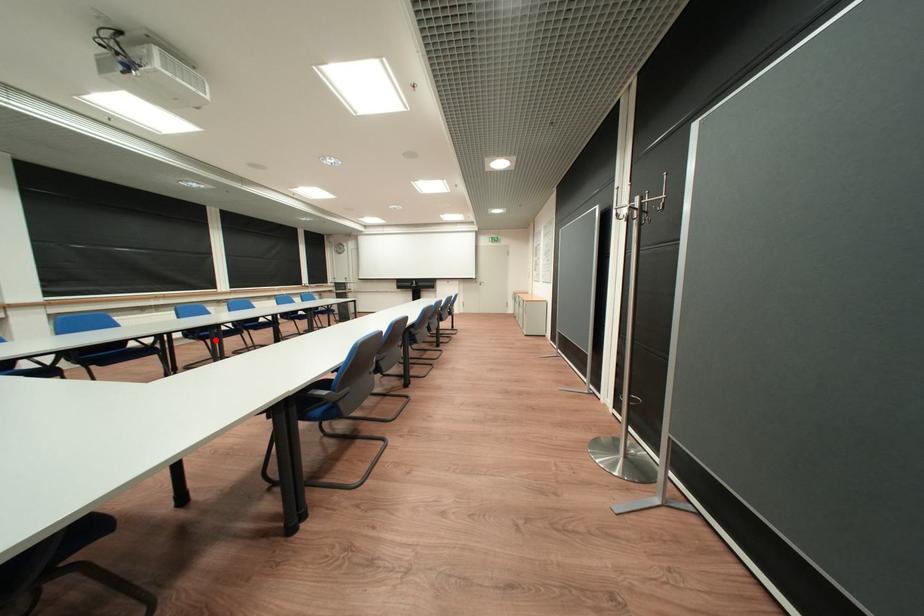
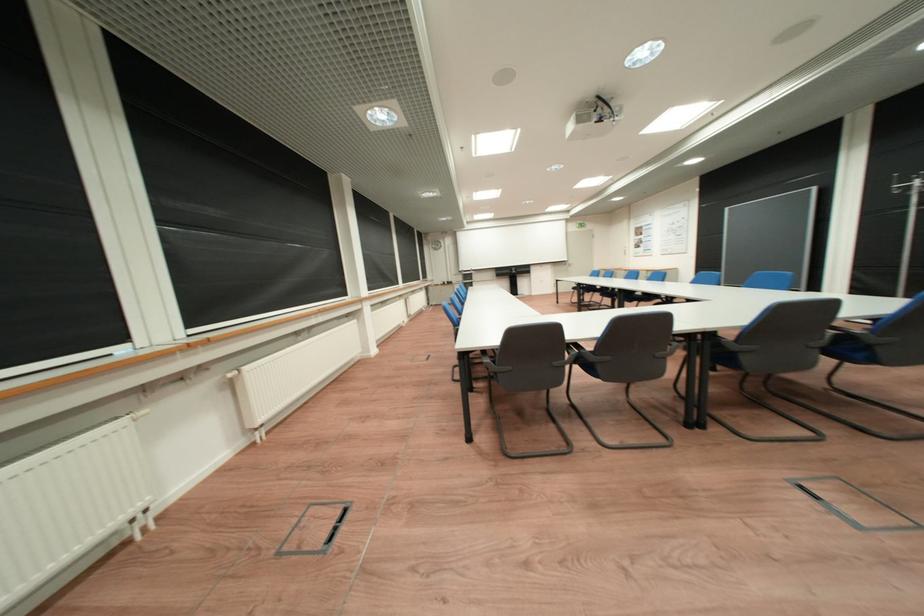
Question: I am providing you with two images of the same scene from different viewpoints. A red point is marked on the first image. Can you still see the location of the red point in image 2?

Choices:
 (A) Yes
 (B) No

Answer: (B)